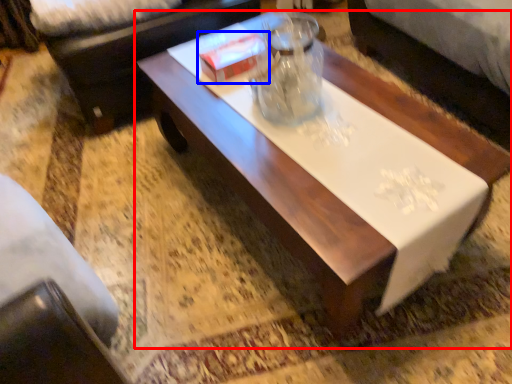
Question: Among these objects, which one is nearest to the camera, coffee table (highlighted by a red box) or box (highlighted by a blue box)?

Choices:
 (A) coffee table
 (B) box

Answer: (A)